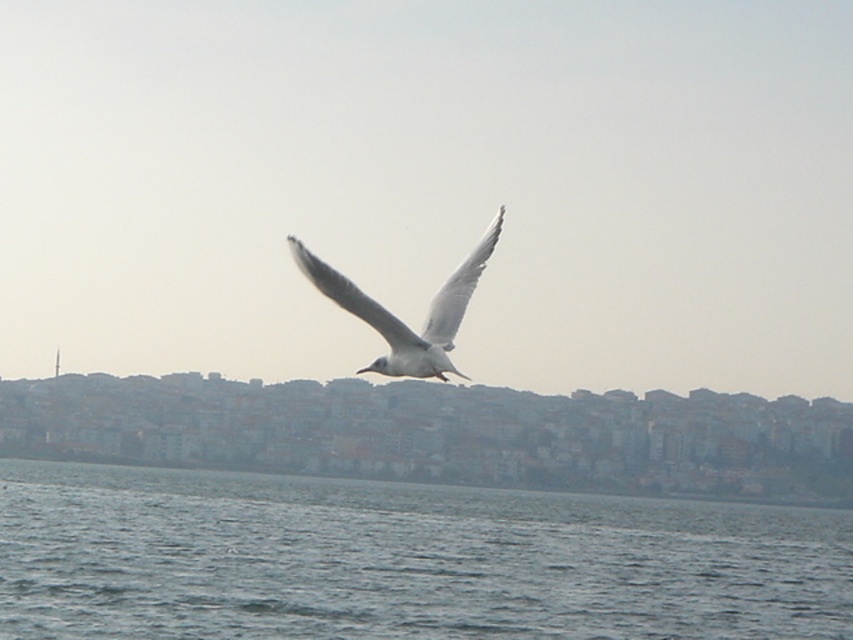
You are a photographer standing on a cliff overlooking the coast. You see the gray water at lower center and the white feathered bird at center. Which object is closer to your camera lens?

The gray water at lower center is further to the viewer than the white feathered bird at center, so the white feathered bird at center is closer to the camera lens.

From the picture: You are a drone operator trying to locate a specific point in the coastal scene. The point is marked at coordinates point [402,561]. Based on the scene description, what is the location of this point?

The point [402,561] is located at the gray water at lower center.

You are standing at the center of the image and want to locate the gray water at lower center. According to the coordinates provided, in which direction should you look to find it?

The gray water at lower center is located at coordinates point (402, 561). Since the coordinate system is not specified, but typically in such contexts, the origin might be at the bottom left corner with x increasing to the right and y increasing upwards. However, without explicit coordinate system details, it is safest to state that the gray water is at the lower center as described in the scene, so you should look downward from the center towards the lower part of the image.